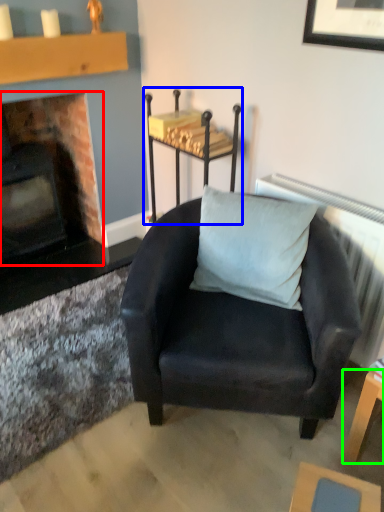
Question: Which is nearer to the fireplace (highlighted by a red box)? table (highlighted by a blue box) or table (highlighted by a green box).

Choices:
 (A) table
 (B) table

Answer: (A)